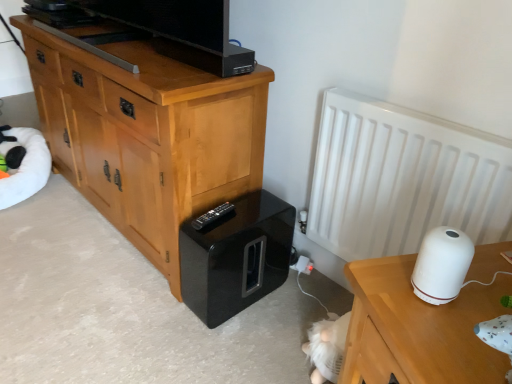
Find the location of a particular element. This screenshot has width=512, height=384. vacant point to the right of glossy black speaker at lower center is located at coordinates (291, 302).